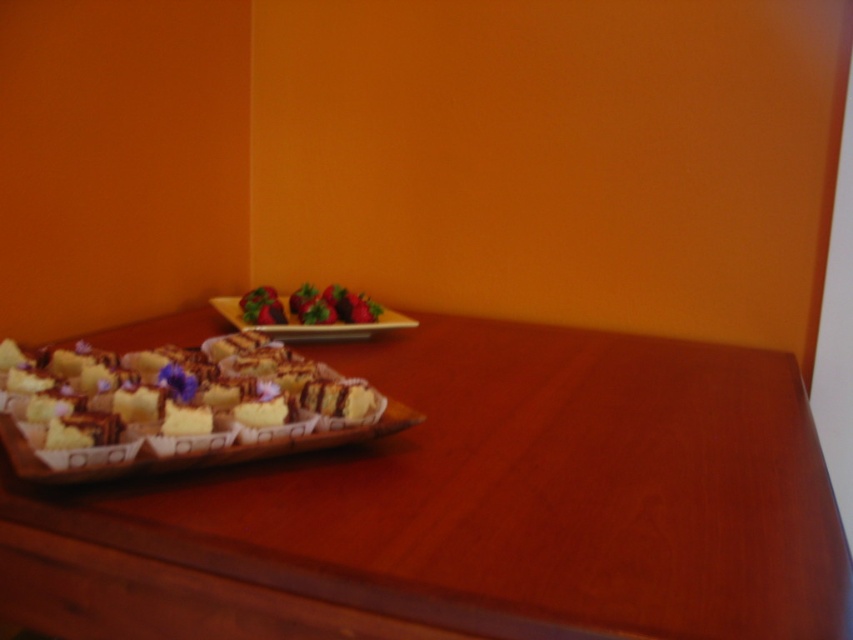
Is the position of wooden table at lower left more distant than that of white paper cupcake at lower left?

No, it is in front of white paper cupcake at lower left.

Can you confirm if wooden table at lower left is positioned to the left of white paper cupcake at lower left?

Incorrect, wooden table at lower left is not on the left side of white paper cupcake at lower left.

Is point (849, 563) positioned before point (134, 364)?

Yes, it is in front of point (134, 364).

At what (x,y) coordinates should I click in order to perform the action: click on wooden table at lower left. Please return your answer as a coordinate pair (x, y). Looking at the image, I should click on (473, 508).

Which of these two, wooden table at lower left or wooden rectangular platter at center, stands shorter?

With less height is wooden rectangular platter at center.

Is wooden table at lower left in front of wooden rectangular platter at center?

Yes, wooden table at lower left is in front of wooden rectangular platter at center.

The width and height of the screenshot is (853, 640). Describe the element at coordinates (473, 508) in the screenshot. I see `wooden table at lower left` at that location.

I want to click on wooden table at lower left, so click(x=473, y=508).

Can you confirm if wooden table at lower left is smaller than shiny red strawberries at center?

No, wooden table at lower left is not smaller than shiny red strawberries at center.

Is point (596, 522) farther from camera compared to point (337, 310)?

No, it is in front of (337, 310).

The width and height of the screenshot is (853, 640). I want to click on wooden table at lower left, so click(473, 508).